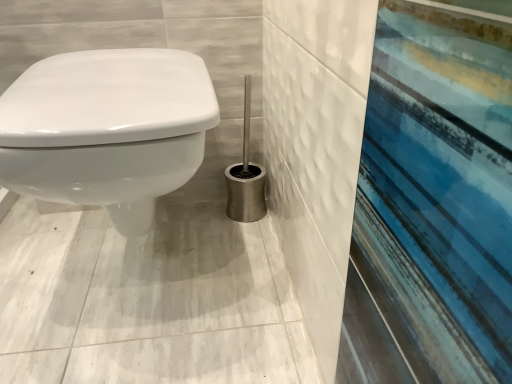
Find the location of a particular element. free point to the left of white glossy toilet at left is located at coordinates (30, 253).